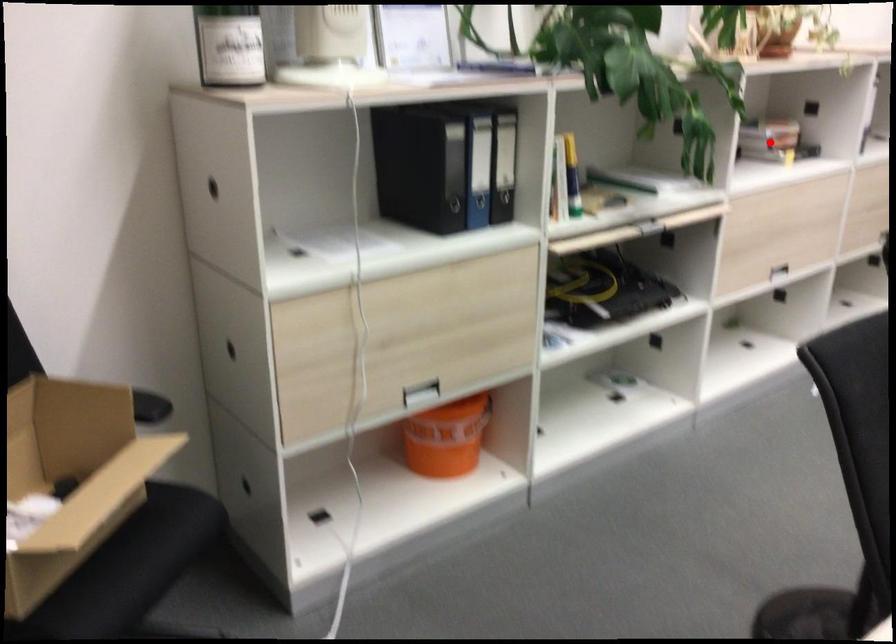
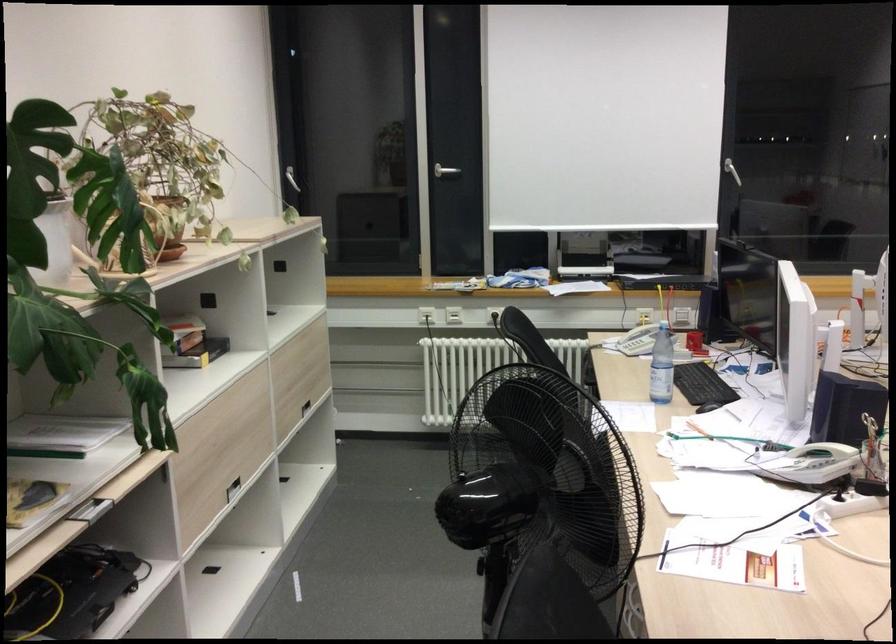
Question: I am providing you with two images of the same scene from different viewpoints. In image1, a red point is highlighted. Considering the same 3D point in image2, which of the following is correct?

Choices:
 (A) It is closer
 (B) It is farther

Answer: (A)